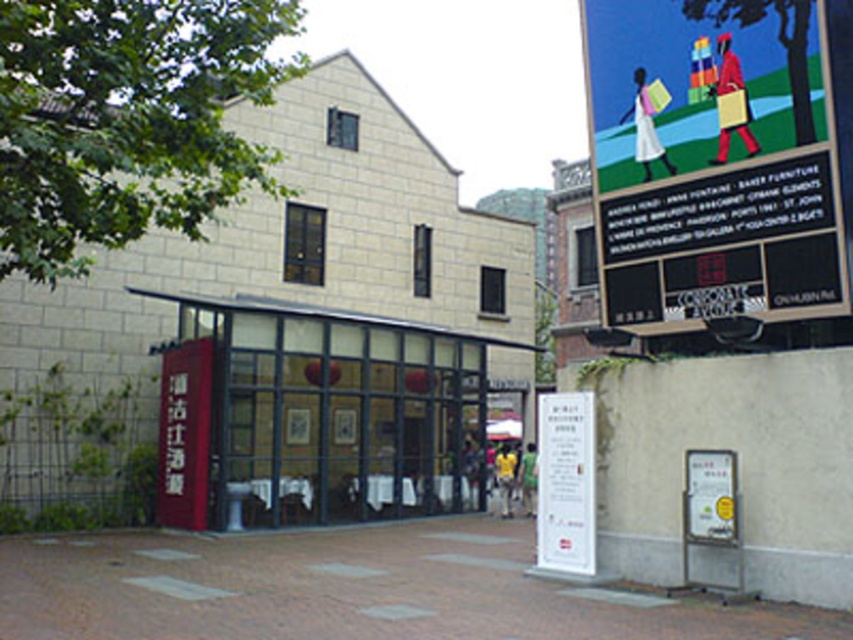
Question: Considering the relative positions of matte blue poster at upper right and white paper sign at center in the image provided, where is matte blue poster at upper right located with respect to white paper sign at center?

Choices:
 (A) left
 (B) right

Answer: (B)

Question: Does matte blue poster at upper right have a greater width compared to white paper sign at center?

Choices:
 (A) yes
 (B) no

Answer: (A)

Question: Among these points, which one is farthest from the camera?

Choices:
 (A) (795, 80)
 (B) (544, 403)

Answer: (B)

Question: Does matte blue poster at upper right lie behind white paper sign at center?

Choices:
 (A) no
 (B) yes

Answer: (A)

Question: Among these objects, which one is nearest to the camera?

Choices:
 (A) white paper sign at center
 (B) matte blue poster at upper right

Answer: (B)